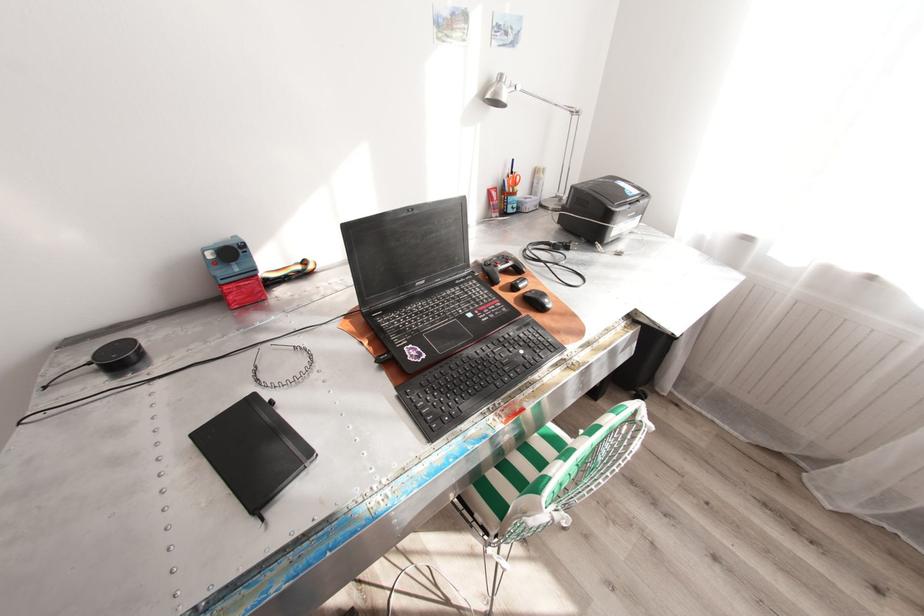
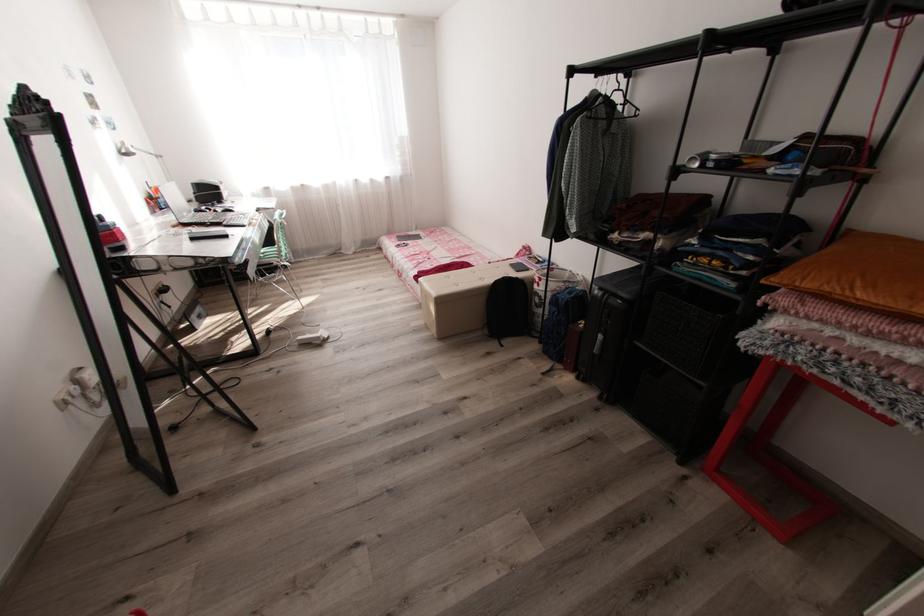
Question: I am providing you with two images of the same scene from different viewpoints. Which of the following objects are not visible in image2?

Choices:
 (A) black woven basket
 (B) silver desk lamp
 (C) black clothes hanger
 (D) none of these

Answer: (D)